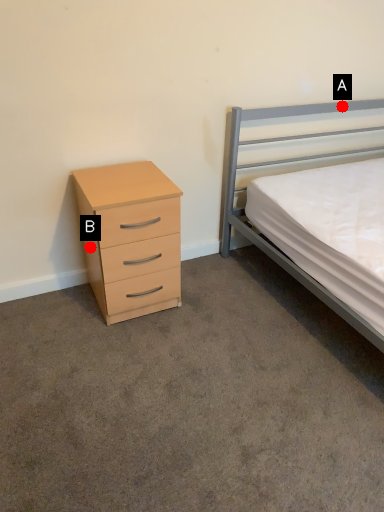
Question: Two points are circled on the image, labeled by A and B beside each circle. Which point is farther from the camera taking this photo?

Choices:
 (A) A is further
 (B) B is further

Answer: (A)